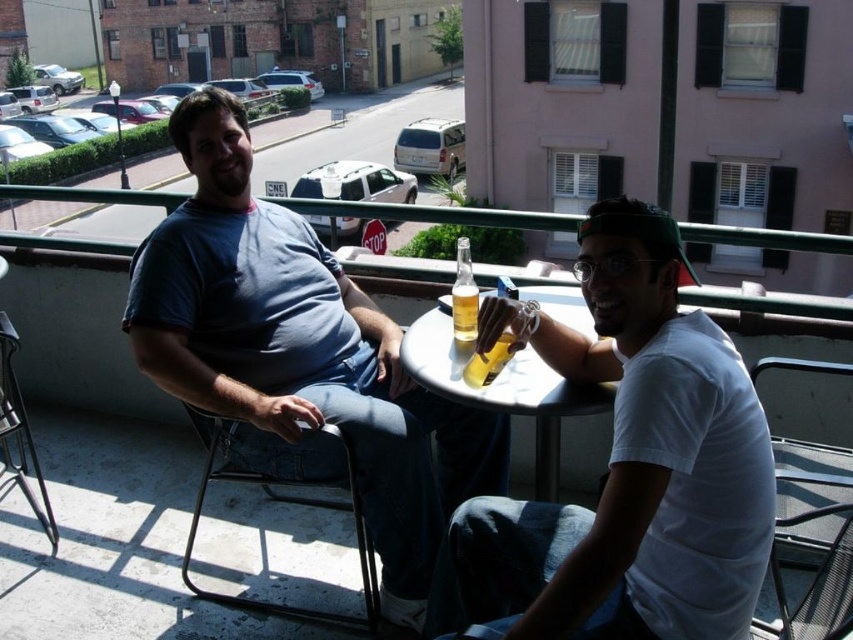
You are a photographer setting up a shot of the scene. You need to ensure that the metallic gray chair at lower right and the translucent glass bottle at center are both in focus. Given that the bottle is shorter than the chair, where should you position your camera to capture both objects clearly?

To capture both the metallic gray chair at lower right and the translucent glass bottle at center clearly, position the camera at a height that accommodates their size difference. Since the metallic gray chair at lower right is taller than the translucent glass bottle at center, adjusting the camera angle slightly downward will ensure both are in focus.

You are a photographer trying to capture a closeup of the two points in the image. The first point is labeled as point (840, 614) and the second is point (509, 340). Which point should you focus on to ensure it appears larger in your photo?

Point (840, 614) is closer to the camera than point (509, 340), so focusing on point (840, 614) will make it appear larger in the photo.

You are a delivery person who needs to place a small package on the surface between the white glossy table at center and the metallic gray chair at lower right. Based on their heights, which object should you place the package on to ensure it is more elevated?

The white glossy table at center has a greater height compared to the metallic gray chair at lower right, so you should place the package on the white glossy table at center to ensure it is more elevated.